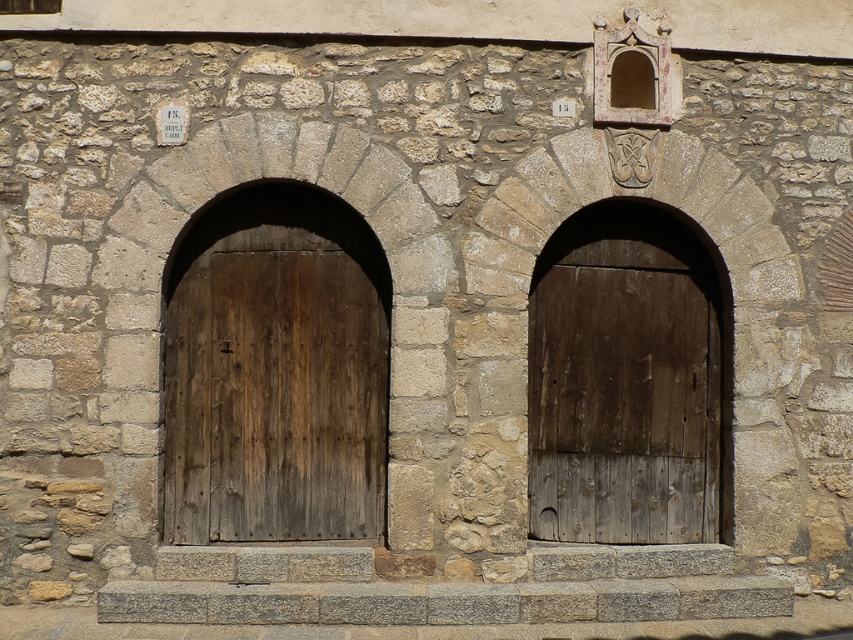
You are an architect designing a new building and want to ensure proper spacing between the two doors. Given that the weathered wood door at center is larger than the dark brown wooden door at center, which door requires more space for its frame?

The weathered wood door at center requires more space for its frame because it is larger in size than the dark brown wooden door at center.

You are standing in front of a stone wall with two arched doors. You need to locate the weathered wood door at center. Based on its 2D coordinates, where would you find it?

The weathered wood door at center is located at the 2D coordinates point (276, 392).